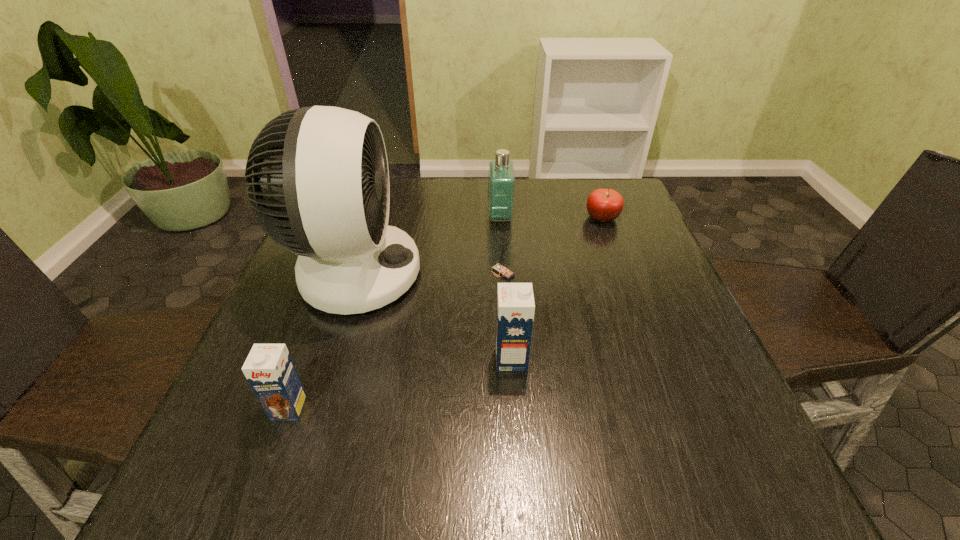
This screenshot has width=960, height=540. I want to click on the left chocolate milk, so click(269, 369).

This screenshot has width=960, height=540. Find the location of `the nearest object`. the nearest object is located at coordinates (269, 369).

The height and width of the screenshot is (540, 960). In order to click on the farther chocolate milk in this screenshot , I will do `click(515, 301)`.

Where is `the right chocolate milk`? the right chocolate milk is located at coordinates (515, 301).

You are a GUI agent. You are given a task and a screenshot of the screen. Output one action in this format:
    pyautogui.click(x=<x>, y=<y>)
    Task: Click on the rightmost object
    This screenshot has height=540, width=960.
    Given the screenshot: What is the action you would take?
    pyautogui.click(x=604, y=205)

Where is `perfume`? perfume is located at coordinates (501, 177).

This screenshot has height=540, width=960. Identify the location of the tallest object. (318, 184).

Image resolution: width=960 pixels, height=540 pixels. I want to click on matchbox, so click(x=499, y=268).

The height and width of the screenshot is (540, 960). I want to click on free space located 0.150m on the front label of the second nearest object, so click(605, 359).

The height and width of the screenshot is (540, 960). In order to click on free point located 0.130m on the back of the rightmost object in this screenshot , I will do `click(590, 185)`.